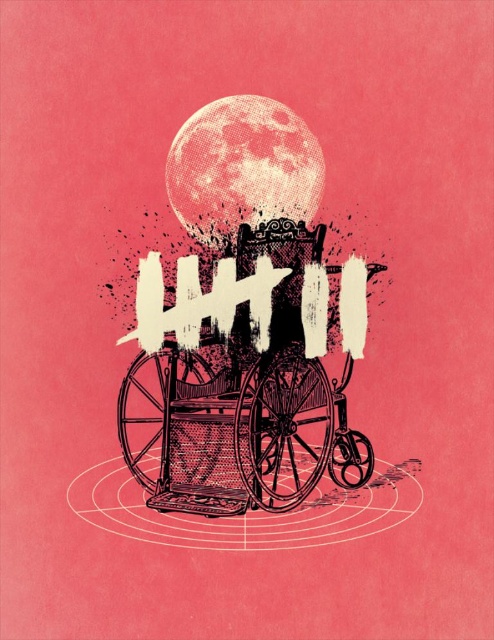
Can you confirm if black ink baby carriage at center is shorter than speckled pink moon at upper center?

Incorrect, black ink baby carriage at center's height does not fall short of speckled pink moon at upper center's.

Is point (317, 380) positioned behind point (232, 100)?

No, (317, 380) is in front of (232, 100).

Where is `black ink baby carriage at center`? black ink baby carriage at center is located at coordinates (247, 403).